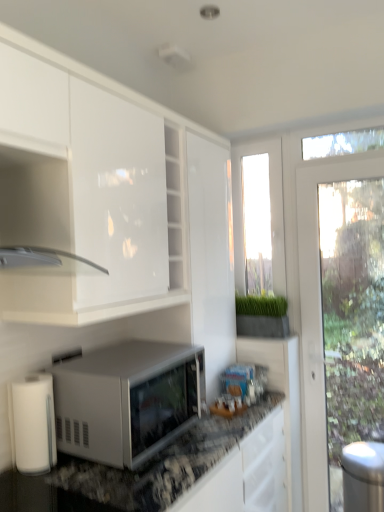
Question: Is there a large distance between stainless steel trash can at right and transparent glass window at center, arranged as the first window screen when viewed from the left?

Choices:
 (A) yes
 (B) no

Answer: (A)

Question: From a real-world perspective, is stainless steel trash can at right positioned under transparent glass window at center, which is counted as the 2th window screen, starting from the right, based on gravity?

Choices:
 (A) yes
 (B) no

Answer: (A)

Question: From the image's perspective, is stainless steel trash can at right below transparent glass window at center, which is counted as the 2th window screen, starting from the right?

Choices:
 (A) yes
 (B) no

Answer: (A)

Question: From a real-world perspective, is stainless steel trash can at right on transparent glass window at center, arranged as the first window screen when viewed from the left?

Choices:
 (A) yes
 (B) no

Answer: (B)

Question: Can you confirm if stainless steel trash can at right is shorter than transparent glass window at center, arranged as the first window screen when viewed from the left?

Choices:
 (A) yes
 (B) no

Answer: (A)

Question: Is stainless steel trash can at right bigger than transparent glass window at center, arranged as the first window screen when viewed from the left?

Choices:
 (A) no
 (B) yes

Answer: (B)

Question: Is stainless steel trash can at right a part of transparent glass window at center, arranged as the first window screen when viewed from the left?

Choices:
 (A) no
 (B) yes

Answer: (A)

Question: Considering the relative positions of transparent glass window at center, which is counted as the 2th window screen, starting from the right, and stainless steel trash can at right in the image provided, is transparent glass window at center, which is counted as the 2th window screen, starting from the right, to the left of stainless steel trash can at right from the viewer's perspective?

Choices:
 (A) yes
 (B) no

Answer: (A)

Question: Is transparent glass window at center, arranged as the first window screen when viewed from the left, turned away from stainless steel trash can at right?

Choices:
 (A) no
 (B) yes

Answer: (A)

Question: Is transparent glass window at center, which is counted as the 2th window screen, starting from the right, directly adjacent to stainless steel trash can at right?

Choices:
 (A) no
 (B) yes

Answer: (A)

Question: Does transparent glass window at center, arranged as the first window screen when viewed from the left, have a lesser height compared to stainless steel trash can at right?

Choices:
 (A) no
 (B) yes

Answer: (A)

Question: Can you confirm if transparent glass window at center, arranged as the first window screen when viewed from the left, is positioned to the right of stainless steel trash can at right?

Choices:
 (A) no
 (B) yes

Answer: (A)

Question: From the image's perspective, is white matte paper towel at lower left under stainless steel trash can at right?

Choices:
 (A) yes
 (B) no

Answer: (B)